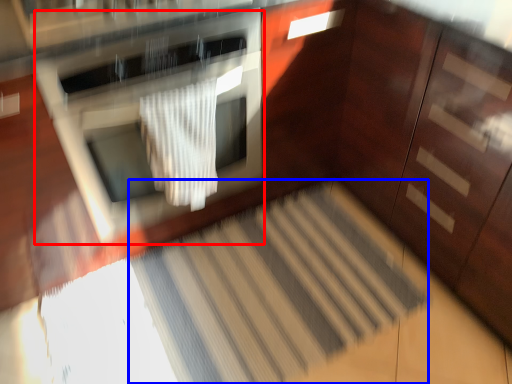
Question: Which object appears farthest to the camera in this image, oven (highlighted by a red box) or stair (highlighted by a blue box)?

Choices:
 (A) oven
 (B) stair

Answer: (B)